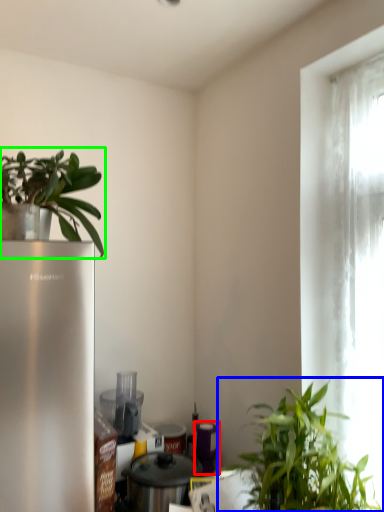
Question: Estimate the real-world distances between objects in this image. Which object is farther from appliance (highlighted by a red box), houseplant (highlighted by a blue box) or houseplant (highlighted by a green box)?

Choices:
 (A) houseplant
 (B) houseplant

Answer: (B)